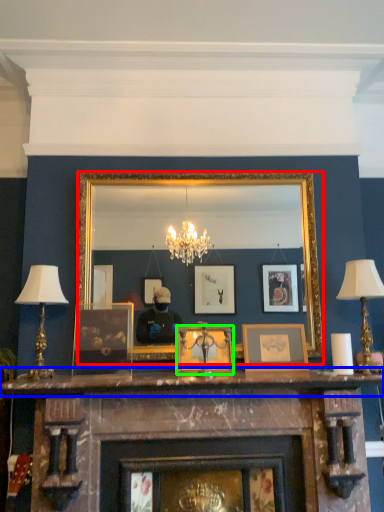
Question: Which object is the farthest from mirror (highlighted by a red box)? Choose among these: mantle (highlighted by a blue box) or picture frame (highlighted by a green box).

Choices:
 (A) mantle
 (B) picture frame

Answer: (A)